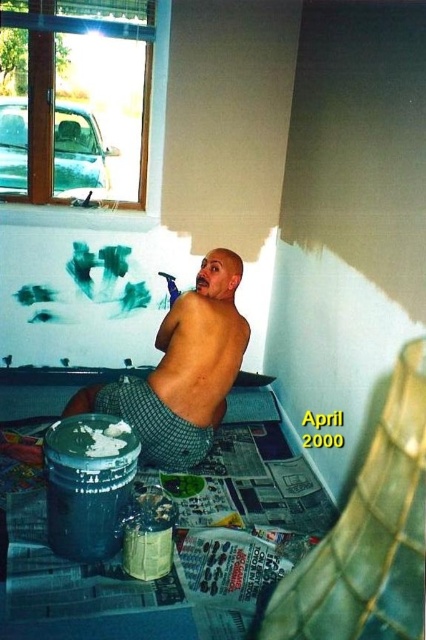
Question: Which object is farther from the camera taking this photo?

Choices:
 (A) shiny metallic paint can at lower left
 (B) muscular tan skin at back

Answer: (B)

Question: Observing the image, what is the correct spatial positioning of shiny metallic paint can at lower left in reference to muscular tan skin at back?

Choices:
 (A) above
 (B) below

Answer: (A)

Question: Is shiny metallic paint can at lower left further to the viewer compared to muscular tan skin at back?

Choices:
 (A) yes
 (B) no

Answer: (B)

Question: Is shiny metallic paint can at lower left thinner than muscular tan skin at back?

Choices:
 (A) yes
 (B) no

Answer: (B)

Question: Which point appears farthest from the camera in this image?

Choices:
 (A) (157, 380)
 (B) (164, 333)

Answer: (B)